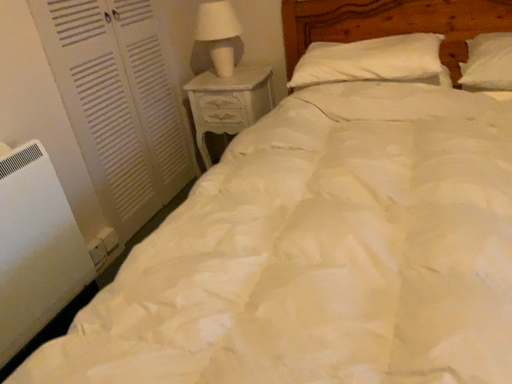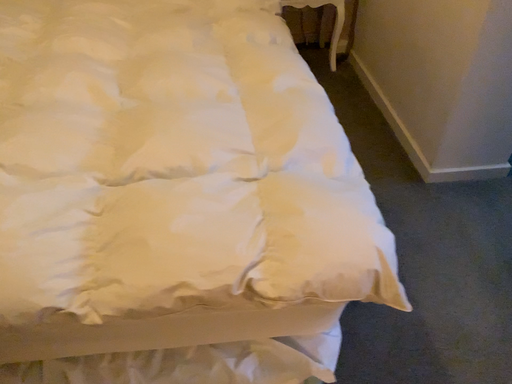
Question: How did the camera likely rotate when shooting the video?

Choices:
 (A) rotated left
 (B) rotated right

Answer: (B)